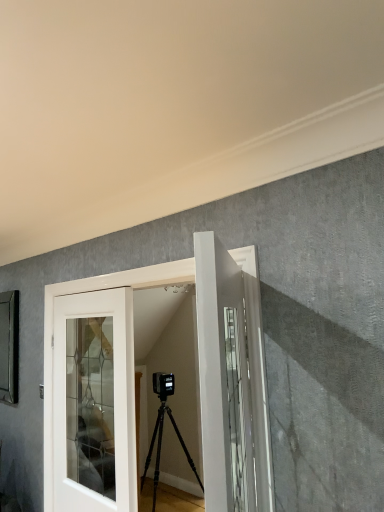
Question: In terms of size, does white glossy door at center, which is the 1th door from front to back, appear bigger or smaller than white glossy door at center, the second door viewed from the back?

Choices:
 (A) small
 (B) big

Answer: (A)

Question: Considering their positions, is white glossy door at center, which is the 1th door from front to back, located in front of or behind white glossy door at center, the 2th door viewed from the front?

Choices:
 (A) behind
 (B) front

Answer: (B)

Question: Based on their relative distances, which object is nearer to the white glossy door at center, placed as the third door when sorted from back to front?

Choices:
 (A) white glass door at center, marked as the third door in a front-to-back arrangement
 (B) white glossy door at center, the second door viewed from the back

Answer: (B)

Question: Estimate the real-world distances between objects in this image. Which object is closer to the white glass door at center, marked as the third door in a front-to-back arrangement?

Choices:
 (A) white glossy door at center, the second door viewed from the back
 (B) white glossy door at center, placed as the third door when sorted from back to front

Answer: (A)